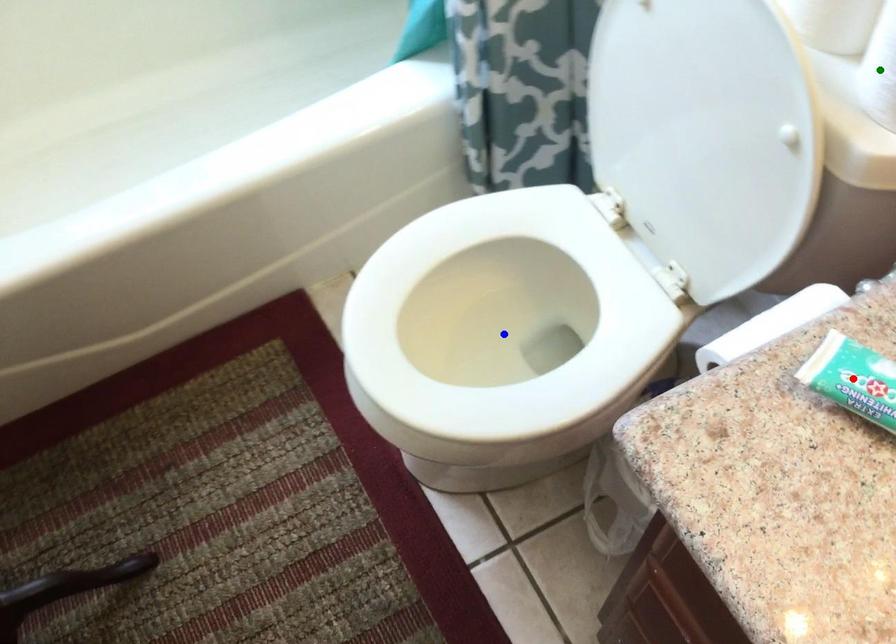
Order these from nearest to farthest:
blue point | green point | red point

1. red point
2. green point
3. blue point